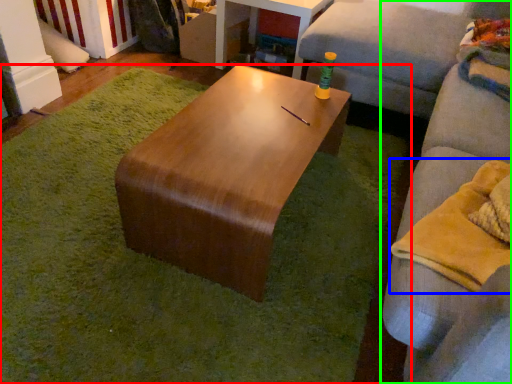
Question: Estimate the real-world distances between objects in this image. Which object is closer to mat (highlighted by a red box), material (highlighted by a blue box) or studio couch (highlighted by a green box)?

Choices:
 (A) material
 (B) studio couch

Answer: (A)